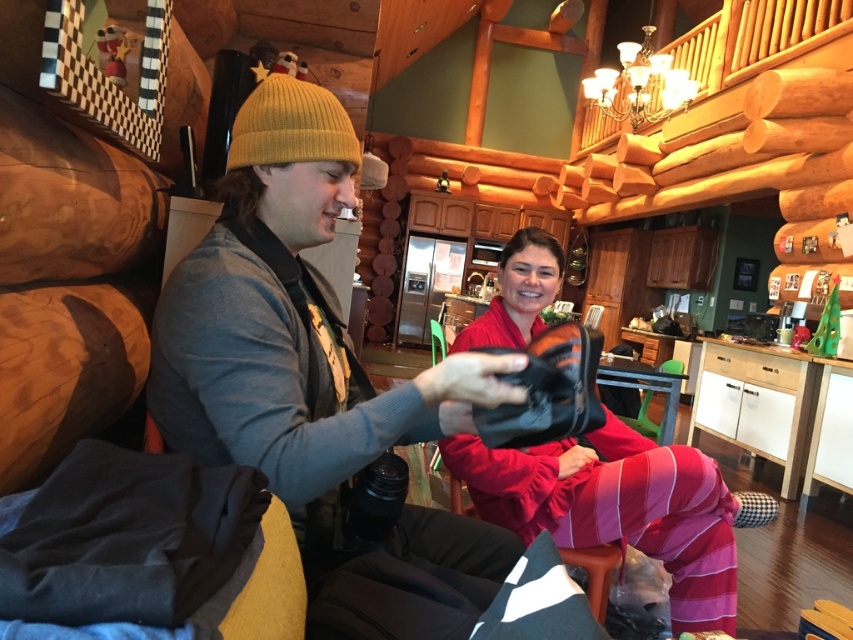
Is matte black shoe at center shorter than matte black boot at center?

Indeed, matte black shoe at center has a lesser height compared to matte black boot at center.

Describe the element at coordinates (289, 317) in the screenshot. The width and height of the screenshot is (853, 640). I see `matte black shoe at center` at that location.

This screenshot has width=853, height=640. I want to click on matte black shoe at center, so click(x=289, y=317).

The image size is (853, 640). Find the location of `matte black shoe at center`. matte black shoe at center is located at coordinates (289, 317).